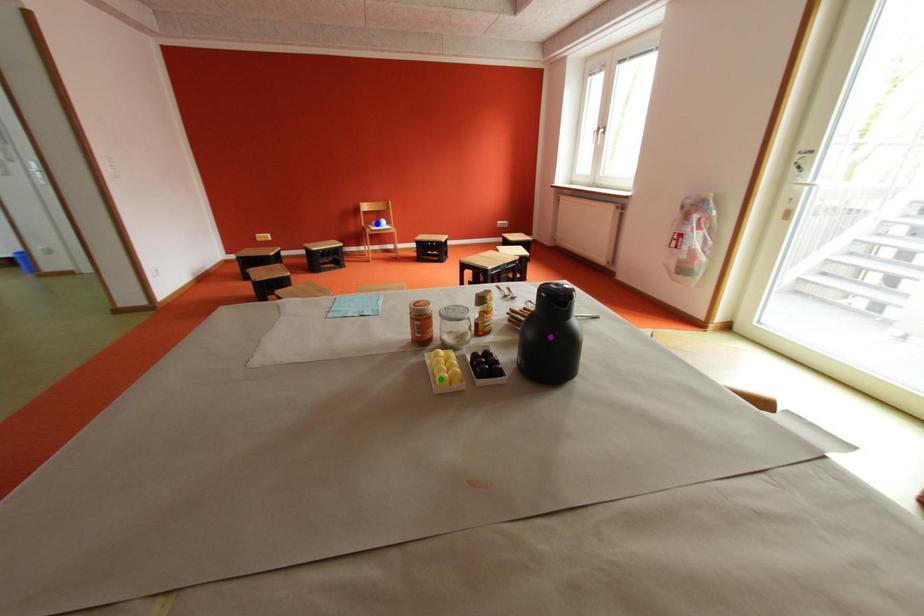
Order these from nearest to farthest:
- green point
- blue point
- purple point

green point → purple point → blue point